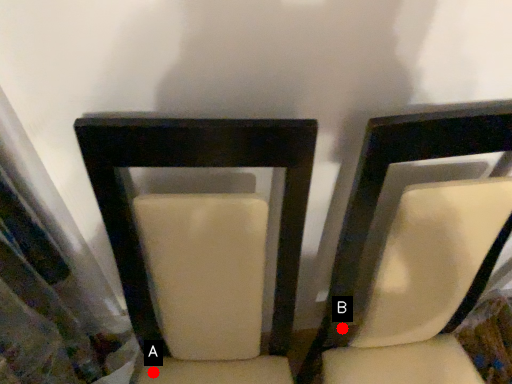
Question: Two points are circled on the image, labeled by A and B beside each circle. Which point is further to the camera?

Choices:
 (A) A is further
 (B) B is further

Answer: (A)